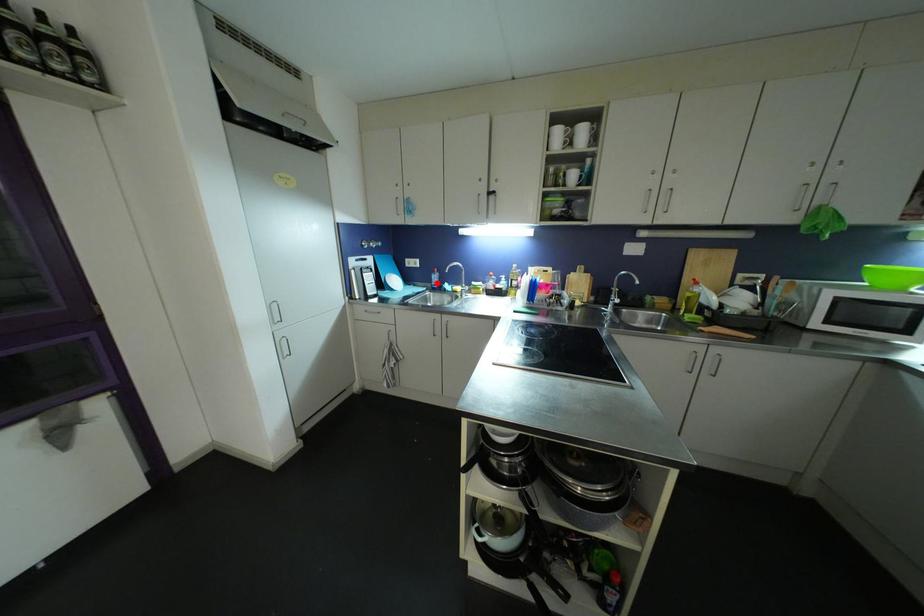
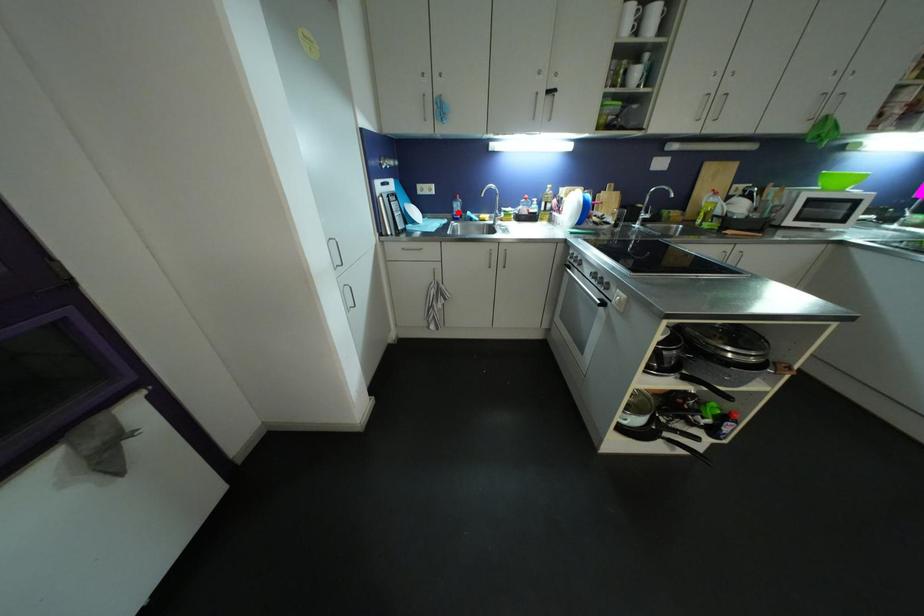
I am providing you with two images of the same scene from different viewpoints. A red point is marked on the first image and another point is marked on the second image. Is the red point in image1 aligned with the point shown in image2?

Yes